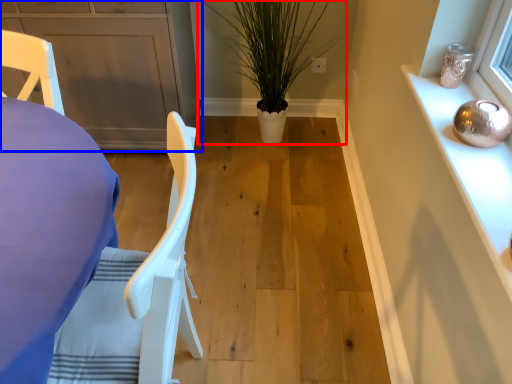
Question: Which object is closer to the camera taking this photo, houseplant (highlighted by a red box) or cabinetry (highlighted by a blue box)?

Choices:
 (A) houseplant
 (B) cabinetry

Answer: (A)